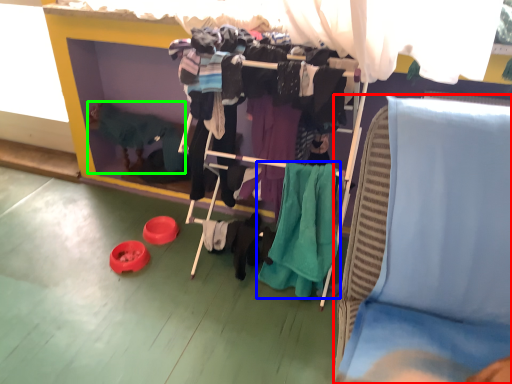
Question: Estimate the real-world distances between objects in this image. Which object is closer to furniture (highlighted by a red box), clothing (highlighted by a blue box) or person (highlighted by a green box)?

Choices:
 (A) clothing
 (B) person

Answer: (A)